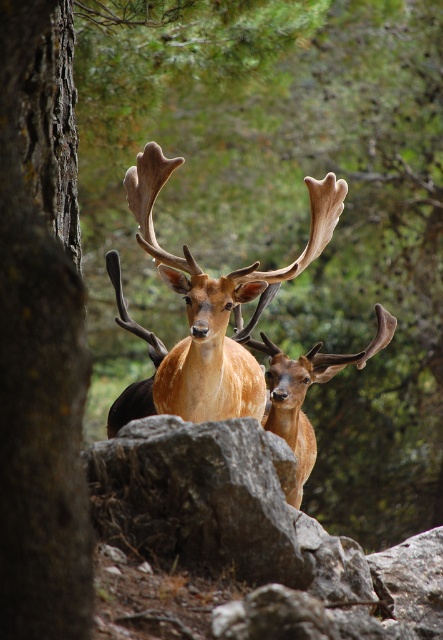
Locate an element on the screen. rough bark tree at left is located at coordinates pos(41,332).

Which is more to the left, rough bark tree at left or shiny brown antlers at center?

From the viewer's perspective, rough bark tree at left appears more on the left side.

Which is behind, point (42, 227) or point (283, 368)?

The point (283, 368) is behind.

Identify the location of rough bark tree at left. Image resolution: width=443 pixels, height=640 pixels. (41, 332).

Is rough bark tree at left below golden fur antlers at center?

Incorrect, rough bark tree at left is not positioned below golden fur antlers at center.

Which of these two, rough bark tree at left or golden fur antlers at center, stands shorter?

rough bark tree at left is shorter.

Is point (57, 493) more distant than point (261, 301)?

No, (57, 493) is closer to viewer.

This screenshot has width=443, height=640. I want to click on rough bark tree at left, so click(41, 332).

Does golden fur antlers at center have a greater width compared to shiny brown antlers at center?

Correct, the width of golden fur antlers at center exceeds that of shiny brown antlers at center.

Can you confirm if golden fur antlers at center is shorter than shiny brown antlers at center?

Incorrect, golden fur antlers at center's height does not fall short of shiny brown antlers at center's.

Which is behind, point (322, 234) or point (299, 440)?

Point (299, 440)

Locate an element on the screen. The width and height of the screenshot is (443, 640). golden fur antlers at center is located at coordinates (205, 310).